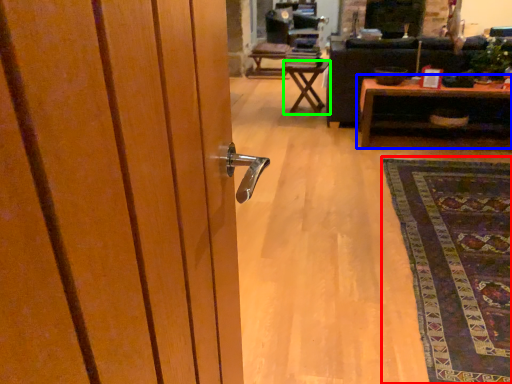
Question: Estimate the real-world distances between objects in this image. Which object is farther from mat (highlighted by a red box), table (highlighted by a blue box) or table (highlighted by a green box)?

Choices:
 (A) table
 (B) table

Answer: (B)